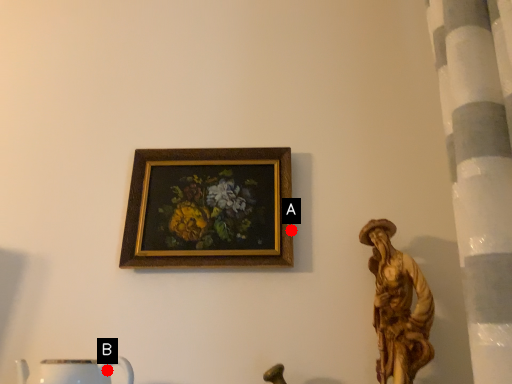
Question: Two points are circled on the image, labeled by A and B beside each circle. Among these points, which one is nearest to the camera?

Choices:
 (A) A is closer
 (B) B is closer

Answer: (B)